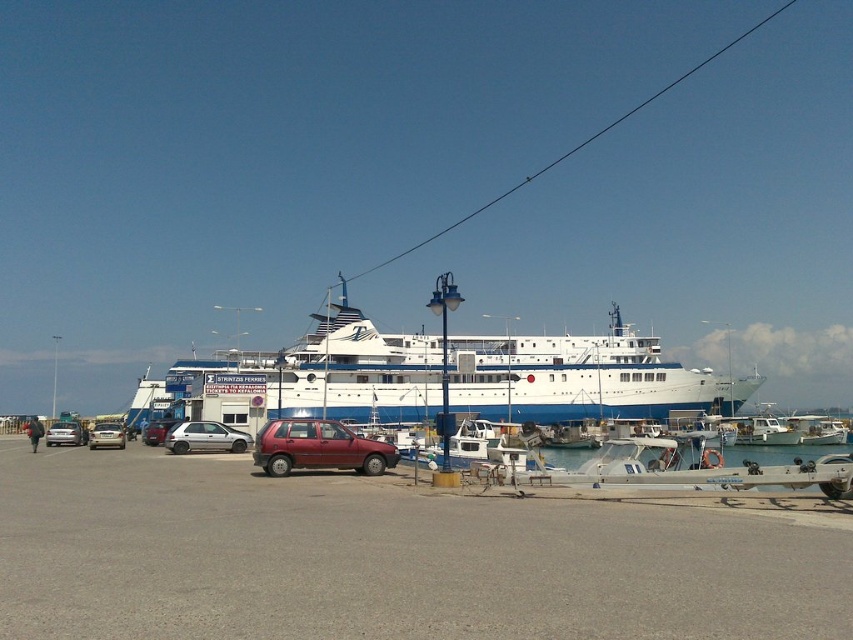
Question: Among these objects, which one is farthest from the camera?

Choices:
 (A) silver metallic car at center
 (B) maroon matte hatchback at center
 (C) silver metallic car at left
 (D) gray asphalt parking lot at center

Answer: (C)

Question: Which point is farther from the camera taking this photo?

Choices:
 (A) (148, 435)
 (B) (115, 451)
 (C) (120, 422)
 (D) (74, 444)

Answer: (C)

Question: Is silver metallic hatchback at center smaller than silver metallic car at left?

Choices:
 (A) no
 (B) yes

Answer: (B)

Question: Can you confirm if gray asphalt parking lot at center is bigger than silver metallic car at center?

Choices:
 (A) yes
 (B) no

Answer: (B)

Question: Can you confirm if gray asphalt parking lot at center is positioned below matte red car at center?

Choices:
 (A) no
 (B) yes

Answer: (A)

Question: Which of the following is the closest to the observer?

Choices:
 (A) (171, 424)
 (B) (97, 436)

Answer: (B)